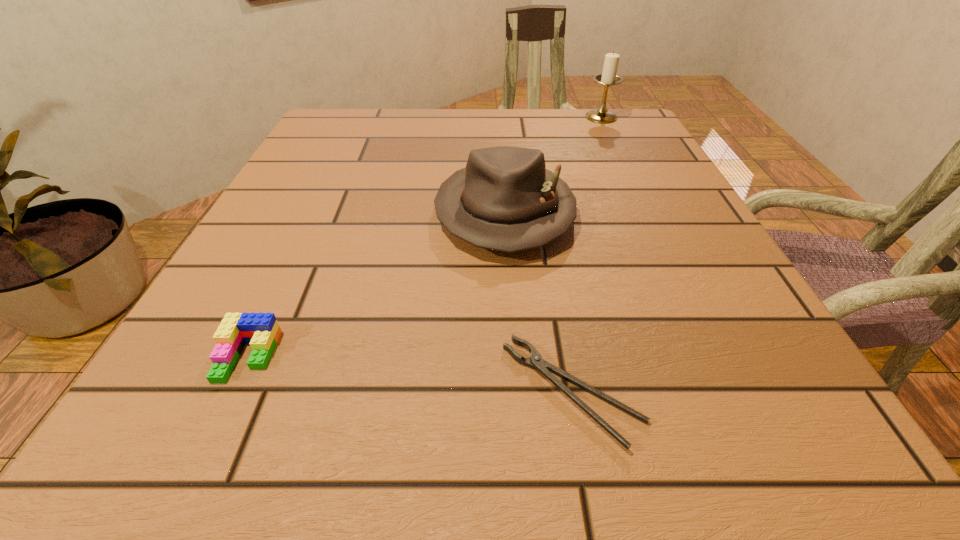
Locate an element on the screen. The image size is (960, 540). blank area located on the left of the tongs is located at coordinates (257, 392).

You are a GUI agent. You are given a task and a screenshot of the screen. Output one action in this format:
    pyautogui.click(x=<x>, y=<y>)
    Task: Click on the object situated at the far edge
    The height and width of the screenshot is (540, 960).
    Given the screenshot: What is the action you would take?
    pyautogui.click(x=608, y=77)

Where is `object present at the near edge`? This screenshot has width=960, height=540. object present at the near edge is located at coordinates (535, 361).

Find the location of a particular element. This screenshot has height=540, width=960. object that is at the left edge is located at coordinates (261, 330).

Image resolution: width=960 pixels, height=540 pixels. I want to click on object that is at the right edge, so click(608, 77).

Find the location of `object that is positioned at the far right corner`. object that is positioned at the far right corner is located at coordinates (608, 77).

Locate an element on the screen. free space at the far edge of the desktop is located at coordinates (510, 108).

This screenshot has height=540, width=960. In the image, there is a desktop. What are the coordinates of `vacant region at the left edge` in the screenshot? It's located at (370, 160).

Find the location of a particular element. vacant space at the right edge of the desktop is located at coordinates (644, 176).

Locate an element on the screen. The image size is (960, 540). vacant space at the far left corner of the desktop is located at coordinates (322, 119).